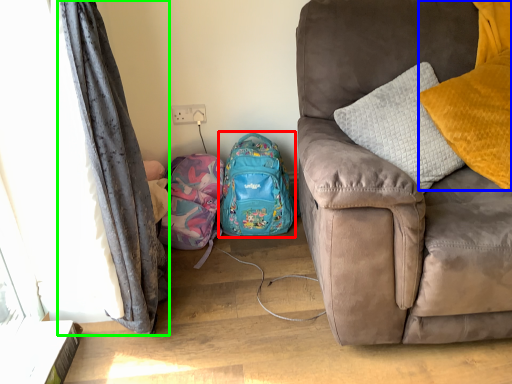
Question: Based on their relative distances, which object is farther from backpack (highlighted by a red box)? Choose from pillow (highlighted by a blue box) and curtain (highlighted by a green box).

Choices:
 (A) pillow
 (B) curtain

Answer: (A)